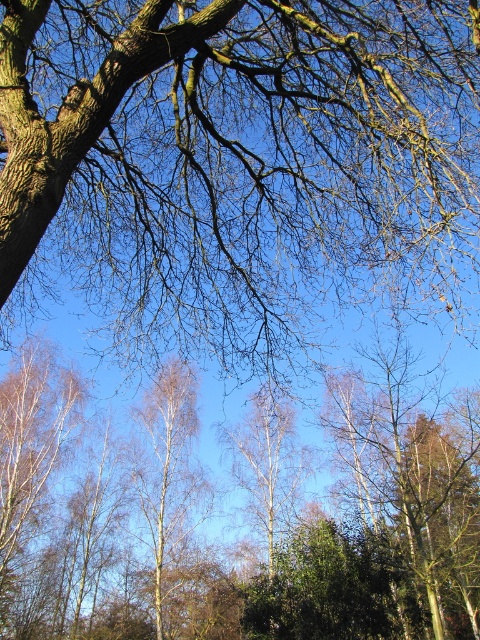
You are standing in the middle of the forest scene shown. You notice two points marked in the image. Which point, point [216,304] or point [166,458], is closer to you?

Point [216,304] is closer to the camera than point [166,458], so it is closer to you.

You are an artist sketching the scene and want to draw the brown rough bark tree at upper left and the white smooth birch tree at center. Which tree should you draw first to properly represent their positions in the image?

You should draw the brown rough bark tree at upper left first because it is in front of the white smooth birch tree at center, so it needs to be placed over the birch tree in the sketch.

You are standing in the middle of the forest looking at the scene. There is a point marked at coordinates (240, 154). Which object in the scene corresponds to this point?

The point at coordinates (240, 154) corresponds to the brown rough bark tree at upper left.